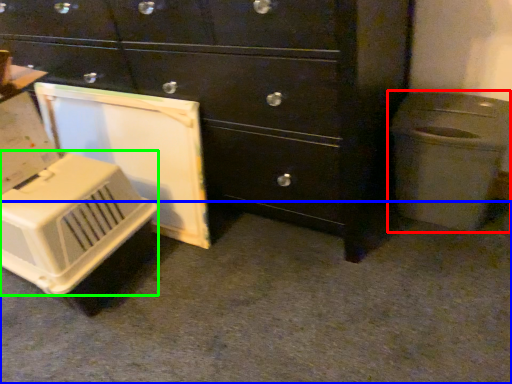
Question: Based on their relative distances, which object is farther from waste container (highlighted by a red box)? Choose from concrete (highlighted by a blue box) and appliance (highlighted by a green box).

Choices:
 (A) concrete
 (B) appliance

Answer: (B)